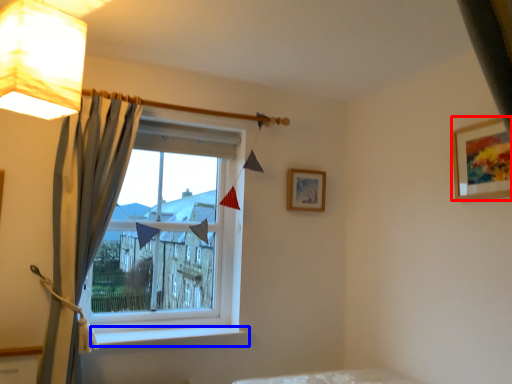
Question: Which object is further to the camera taking this photo, picture frame (highlighted by a red box) or window sill (highlighted by a blue box)?

Choices:
 (A) picture frame
 (B) window sill

Answer: (B)